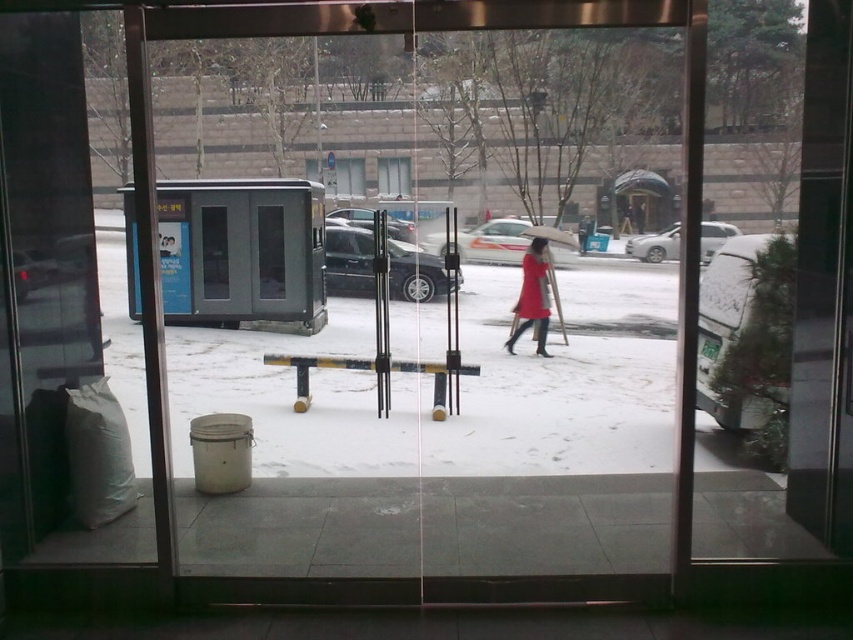
Question: Where is matte red coat at center located in relation to brown fabric umbrella at center in the image?

Choices:
 (A) left
 (B) right

Answer: (A)

Question: Does matte red coat at center lie behind clear glass window at center?

Choices:
 (A) yes
 (B) no

Answer: (B)

Question: Is matte red coat at center below brown fabric umbrella at center?

Choices:
 (A) no
 (B) yes

Answer: (B)

Question: Considering the real-world distances, which object is closest to the matte red coat at center?

Choices:
 (A) brown fabric umbrella at center
 (B) clear glass window at center

Answer: (A)

Question: Which point is farther to the camera?

Choices:
 (A) clear glass window at center
 (B) brown fabric umbrella at center
 (C) matte red coat at center

Answer: (A)

Question: Which of the following is the farthest from the observer?

Choices:
 (A) brown fabric umbrella at center
 (B) clear glass window at center
 (C) matte red coat at center

Answer: (B)